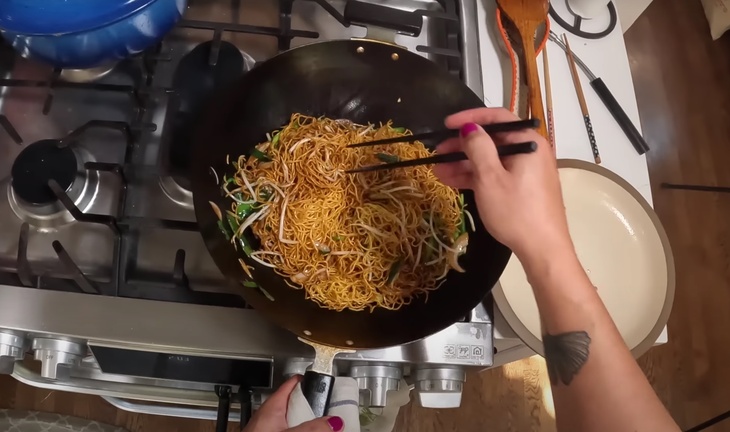
The width and height of the screenshot is (730, 432). Find the location of `chop stick`. chop stick is located at coordinates pos(423,144).